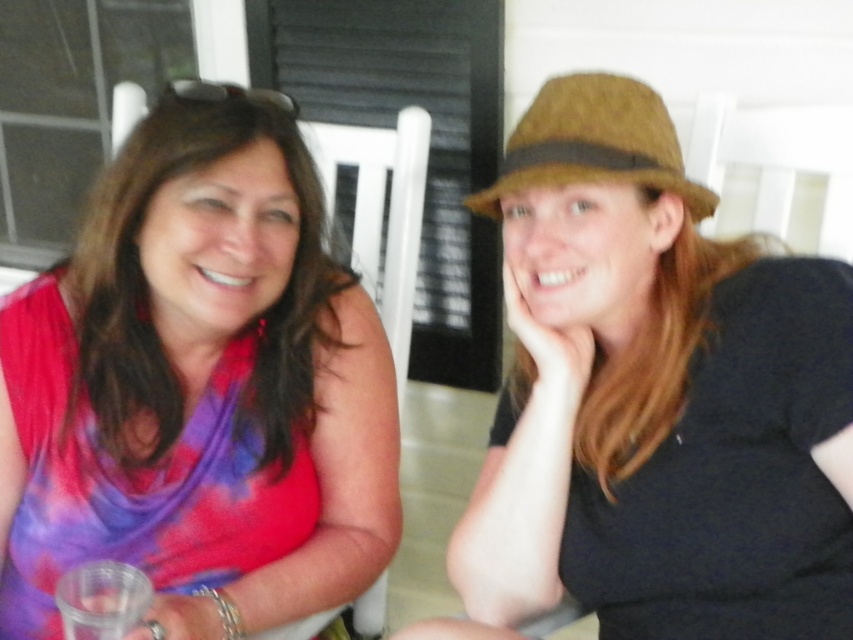
Does point (71, 486) lie in front of point (558, 141)?

No, it is not.

Is matte tie-dye tank top at left positioned behind brown felt fedora at upper right?

That is True.

At what (x,y) coordinates should I click in order to perform the action: click on matte tie-dye tank top at left. Please return your answer as a coordinate pair (x, y). The width and height of the screenshot is (853, 640). Looking at the image, I should click on (198, 387).

Who is taller, brown felt hat at upper right or brown felt fedora at upper right?

With more height is brown felt hat at upper right.

Which of these two, brown felt hat at upper right or brown felt fedora at upper right, stands shorter?

With less height is brown felt fedora at upper right.

Is point (573, 115) positioned before point (581, 99)?

Yes.

Locate an element on the screen. This screenshot has height=640, width=853. brown felt hat at upper right is located at coordinates (653, 397).

Can you confirm if brown felt hat at upper right is wider than matte tie-dye tank top at left?

No.

Does brown felt hat at upper right appear under matte tie-dye tank top at left?

Actually, brown felt hat at upper right is above matte tie-dye tank top at left.

Who is more distant from viewer, (581,282) or (206,454)?

Positioned behind is point (206,454).

This screenshot has width=853, height=640. Find the location of `brown felt hat at upper right`. brown felt hat at upper right is located at coordinates (653, 397).